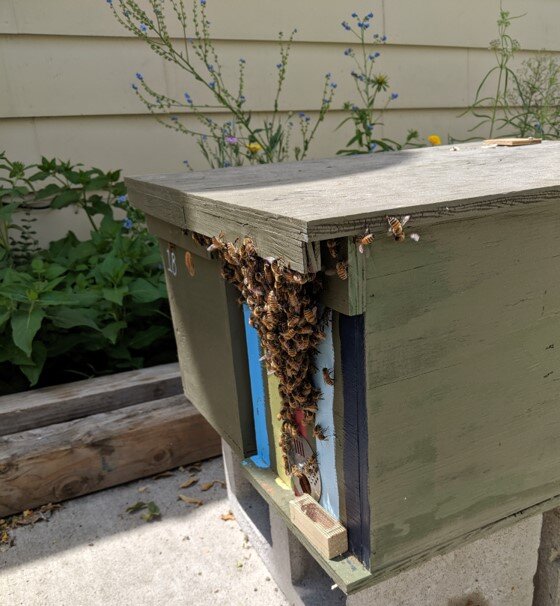
Identify the location of 2 planks of wood on the side. This screenshot has height=606, width=560. (78, 431), (40, 402).